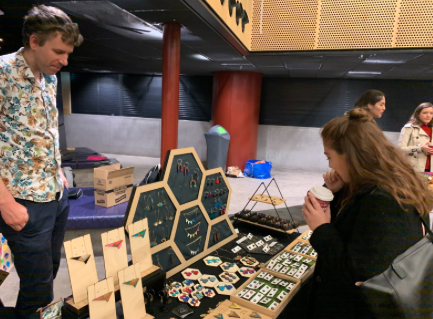
Find the location of a particular element. wooden display cards is located at coordinates (131, 296).